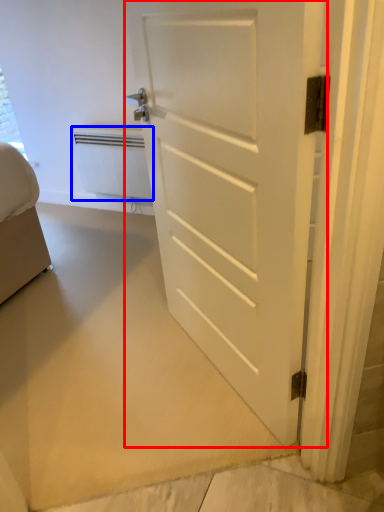
Question: Which of the following is the closest to the observer, door (highlighted by a red box) or radiator (highlighted by a blue box)?

Choices:
 (A) door
 (B) radiator

Answer: (A)